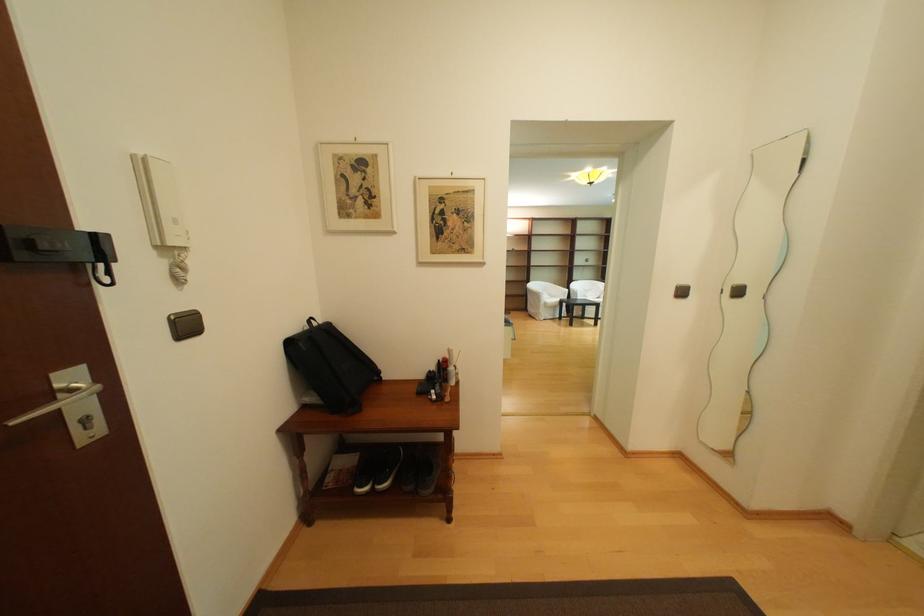
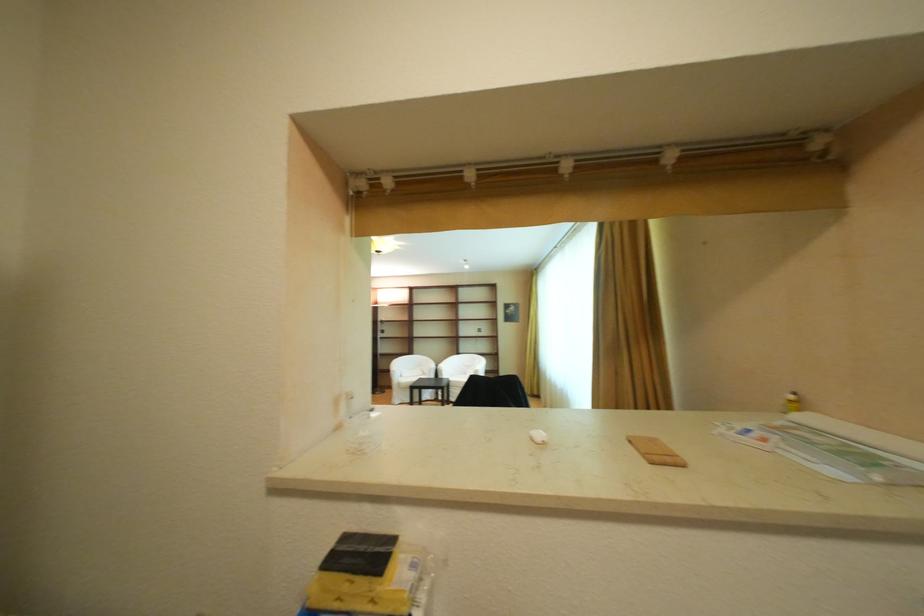
Locate, in the second image, the point that corresponds to [560,285] in the first image.

(436, 359)